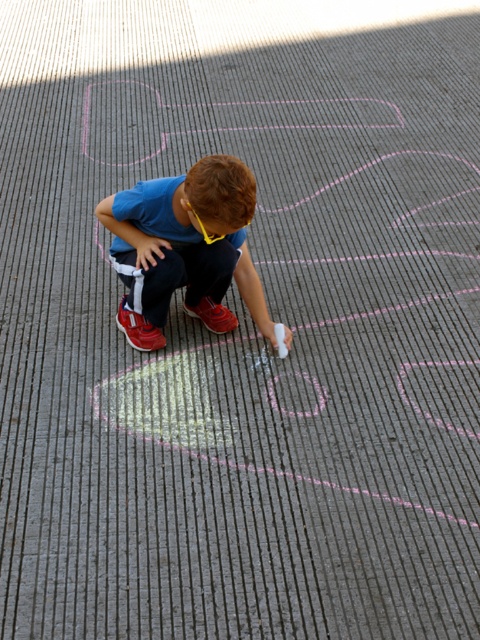
Which is in front, point (178, 205) or point (132, 316)?

Positioned in front is point (178, 205).

Between blue cotton shirt at center and red suede sneaker at lower center, which one is positioned lower?

red suede sneaker at lower center is below.

Is point (156, 307) farther from camera compared to point (148, 330)?

No.

What are the coordinates of `blue cotton shirt at center` in the screenshot? It's located at (184, 248).

Is red suede sneaker at lower center shorter than shiny red sneaker at center?

Incorrect, red suede sneaker at lower center's height does not fall short of shiny red sneaker at center's.

Is red suede sneaker at lower center bigger than shiny red sneaker at center?

Yes, red suede sneaker at lower center is bigger than shiny red sneaker at center.

Where is `red suede sneaker at lower center`? The height and width of the screenshot is (640, 480). red suede sneaker at lower center is located at coordinates (139, 330).

Does blue cotton shirt at center have a larger size compared to shiny red sneaker at center?

Indeed, blue cotton shirt at center has a larger size compared to shiny red sneaker at center.

Who is taller, blue cotton shirt at center or shiny red sneaker at center?

blue cotton shirt at center is taller.

Does point (135, 209) come farther from viewer compared to point (219, 324)?

That is False.

Find the location of `blue cotton shirt at center`. blue cotton shirt at center is located at coordinates (184, 248).